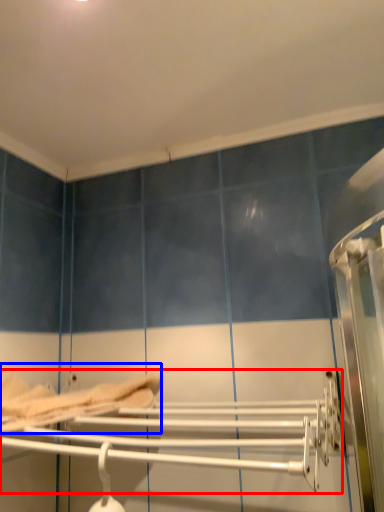
Question: Among these objects, which one is nearest to the camera, towel rack (highlighted by a red box) or bed (highlighted by a blue box)?

Choices:
 (A) towel rack
 (B) bed

Answer: (A)